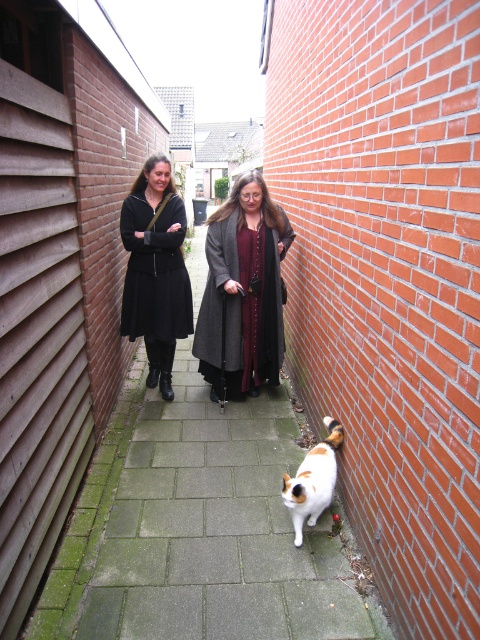
Can you confirm if dark gray wool coat at center is positioned to the left of white fur cat at center?

Yes, dark gray wool coat at center is to the left of white fur cat at center.

Who is positioned more to the right, dark gray wool coat at center or white fur cat at center?

From the viewer's perspective, white fur cat at center appears more on the right side.

Is point (195, 330) positioned before point (303, 476)?

No, (195, 330) is behind (303, 476).

Identify the location of dark gray wool coat at center. (242, 289).

Who is higher up, matte black dress at center or white fur cat at center?

matte black dress at center

Which is in front, point (135, 284) or point (292, 515)?

Point (292, 515)

Identify the location of matte black dress at center. The width and height of the screenshot is (480, 640). (156, 269).

Between dark gray wool coat at center and matte black dress at center, which one appears on the left side from the viewer's perspective?

Positioned to the left is matte black dress at center.

The width and height of the screenshot is (480, 640). In order to click on dark gray wool coat at center in this screenshot , I will do `click(242, 289)`.